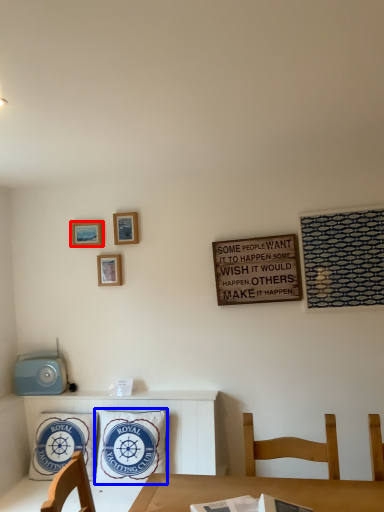
Question: Which object is closer to the camera taking this photo, picture frame (highlighted by a red box) or pillow (highlighted by a blue box)?

Choices:
 (A) picture frame
 (B) pillow

Answer: (B)